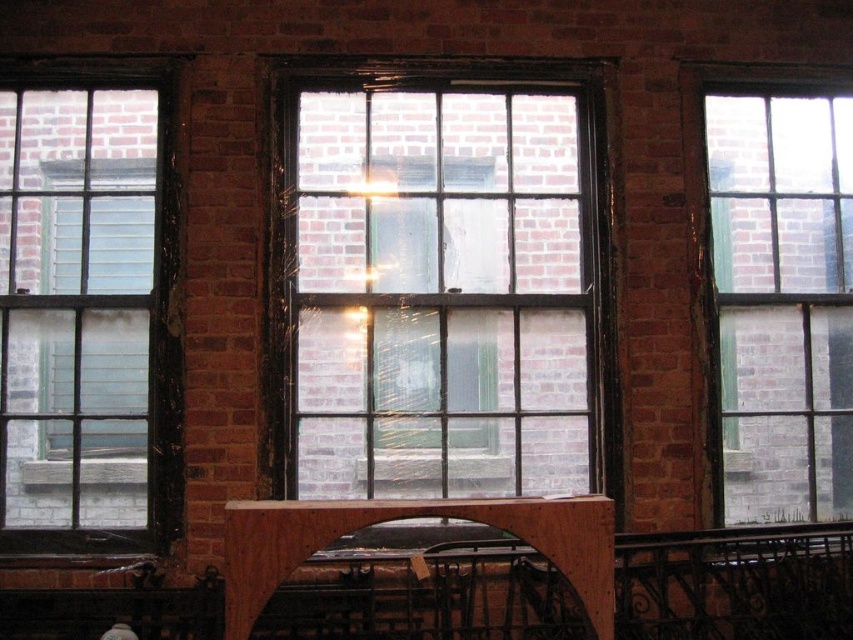
Is point (126, 156) farther from camera compared to point (590, 554)?

That is True.

Who is higher up, clear glass window at left or brown wooden rail at center?

Positioned higher is clear glass window at left.

Does point (50, 83) come behind point (607, 621)?

That is True.

The image size is (853, 640). Find the location of `clear glass window at left`. clear glass window at left is located at coordinates (90, 307).

Between clear glass window at center and clear glass window at left, which one appears on the right side from the viewer's perspective?

From the viewer's perspective, clear glass window at center appears more on the right side.

Is clear glass window at center taller than clear glass window at left?

No.

The width and height of the screenshot is (853, 640). What are the coordinates of `clear glass window at center` in the screenshot? It's located at (440, 285).

Can you confirm if clear glass window at left is smaller than wooden at center?

Indeed, clear glass window at left has a smaller size compared to wooden at center.

Is clear glass window at left bigger than wooden at center?

Actually, clear glass window at left might be smaller than wooden at center.

Which is behind, point (71, 529) or point (155, 627)?

Point (71, 529)

Where is `clear glass window at left`? The height and width of the screenshot is (640, 853). clear glass window at left is located at coordinates (90, 307).